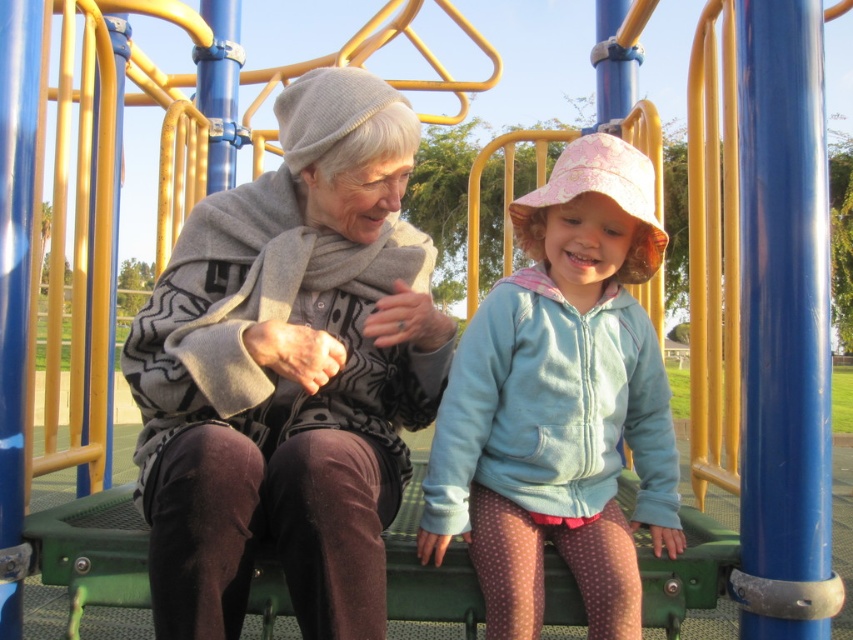
Is knitted gray hat at upper left in front of light blue fleece jacket at center?

Yes, it is in front of light blue fleece jacket at center.

Can you confirm if knitted gray hat at upper left is positioned to the left of light blue fleece jacket at center?

Indeed, knitted gray hat at upper left is positioned on the left side of light blue fleece jacket at center.

Between point (206, 260) and point (622, 326), which one is positioned behind?

Positioned behind is point (206, 260).

At what (x,y) coordinates should I click in order to perform the action: click on knitted gray hat at upper left. Please return your answer as a coordinate pair (x, y). Looking at the image, I should click on (289, 371).